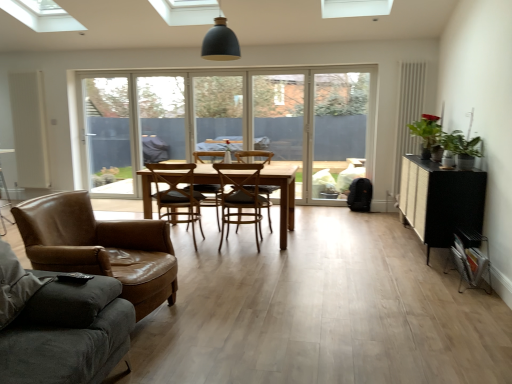
The height and width of the screenshot is (384, 512). Identify the location of vacant space in front of wooden chair at center, arranged as the 3th chair when viewed from the back. (236, 255).